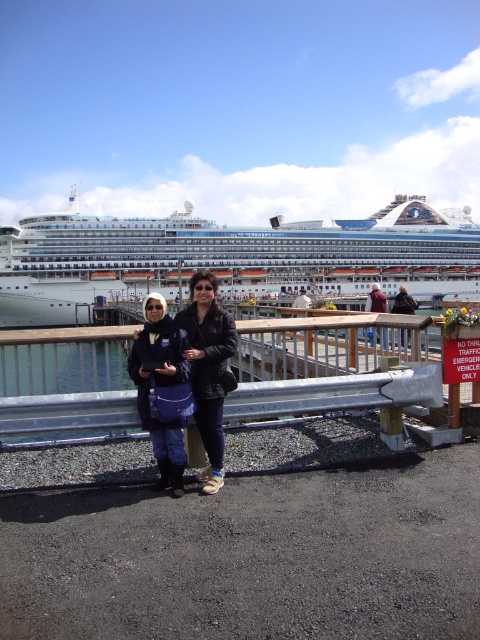
In the scene shown: You are a photographer trying to capture a photo of both the black leather jacket at center and the blue denim jacket at center. Which jacket should you focus on first to ensure it appears sharp in the foreground?

The black leather jacket at center is further to the viewer than the blue denim jacket at center, so you should focus on the black leather jacket at center first to ensure it is sharp in the foreground.